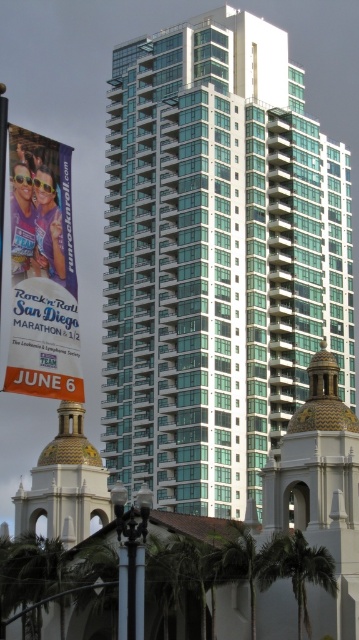
Question: In this image, where is glassy teal building at center located relative to green leafy palm tree at lower right?

Choices:
 (A) right
 (B) left

Answer: (A)

Question: Which point appears closest to the camera in this image?

Choices:
 (A) (72, 474)
 (B) (78, 356)
 (C) (320, 577)

Answer: (B)

Question: Considering the real-world distances, which object is farthest from the gold textured dome at lower left?

Choices:
 (A) green leafy palm tree at lower right
 (B) white stucco dome at center

Answer: (A)

Question: Which of these objects is positioned closest to the green leafy palm tree at lower right?

Choices:
 (A) glassy teal building at center
 (B) white stucco dome at center

Answer: (B)

Question: Does glassy teal building at center appear on the left side of green leafy palm tree at lower right?

Choices:
 (A) no
 (B) yes

Answer: (A)

Question: Does matte purple banner at left have a greater width compared to green leafy palm tree at lower right?

Choices:
 (A) yes
 (B) no

Answer: (A)